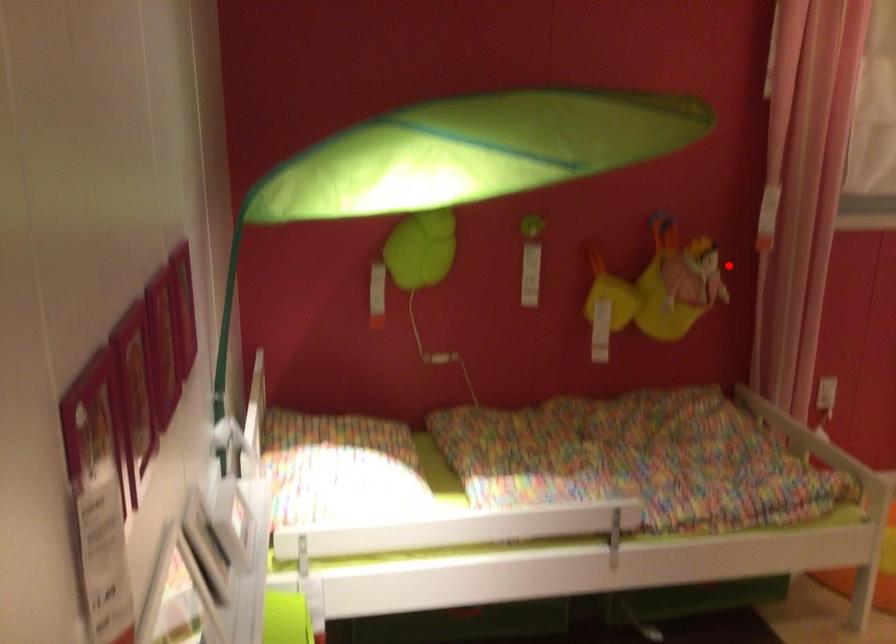
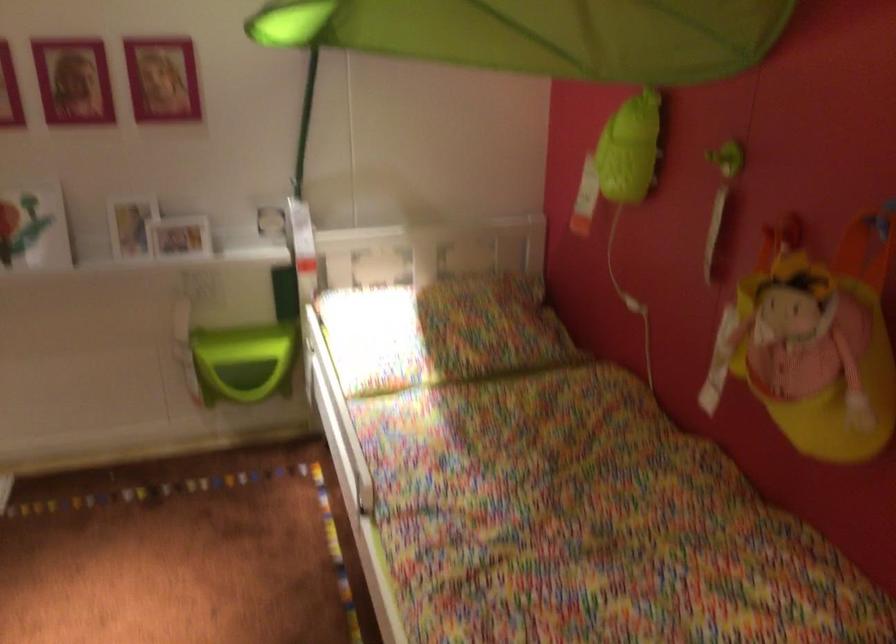
Find the pixel in the second image that matches the highlighted location in the first image.

(814, 342)